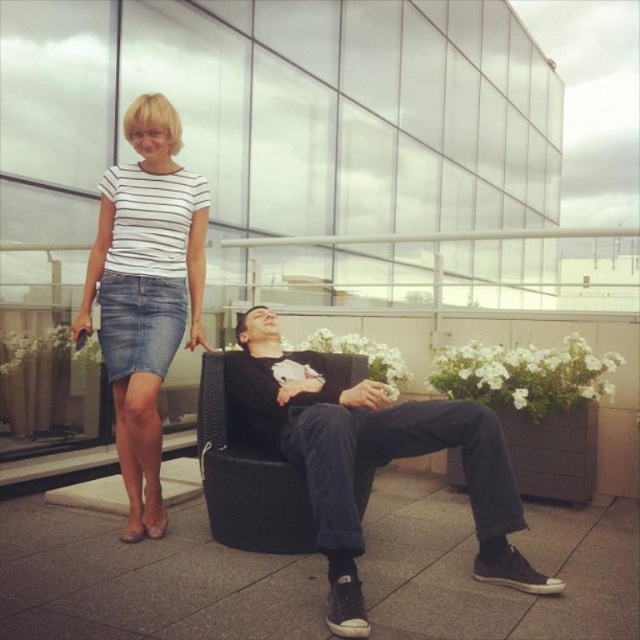
Question: Which object is closer to the camera taking this photo?

Choices:
 (A) black woven swivel chair at center
 (B) denim skirt at left
 (C) black matte chair at center

Answer: (C)

Question: Considering the relative positions of denim skirt at left and black woven swivel chair at center in the image provided, where is denim skirt at left located with respect to black woven swivel chair at center?

Choices:
 (A) above
 (B) below

Answer: (A)

Question: Does denim skirt at left appear over black woven swivel chair at center?

Choices:
 (A) yes
 (B) no

Answer: (A)

Question: Among these objects, which one is farthest from the camera?

Choices:
 (A) black woven swivel chair at center
 (B) black matte chair at center

Answer: (A)

Question: From the image, what is the correct spatial relationship of black matte chair at center in relation to denim skirt at left?

Choices:
 (A) right
 (B) left

Answer: (A)

Question: Which point is closer to the camera?

Choices:
 (A) black woven swivel chair at center
 (B) denim skirt at left
 (C) black matte chair at center

Answer: (C)